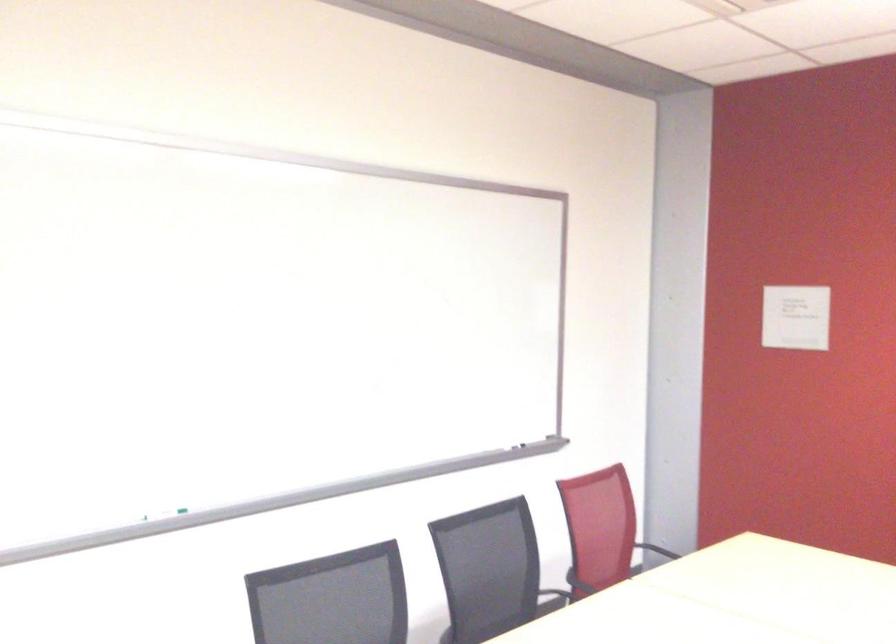
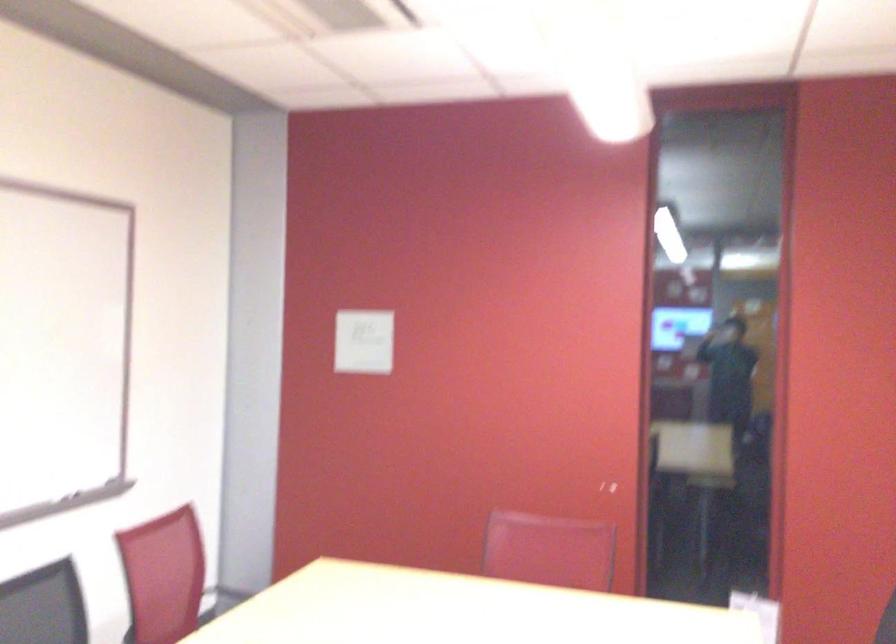
Question: The camera is either moving clockwise (left) or counter-clockwise (right) around the object. The first image is from the beginning of the video and the second image is from the end. Is the camera moving left or right when shooting the video?

Choices:
 (A) Left
 (B) Right

Answer: (A)